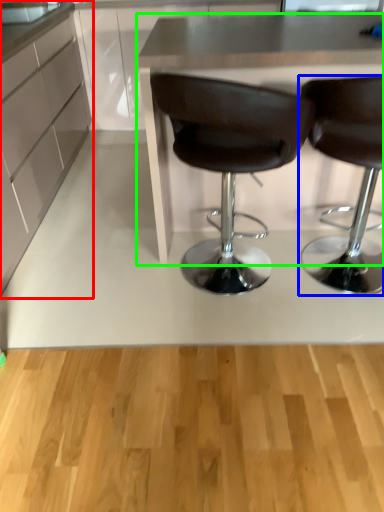
Question: Which object is positioned farthest from cabinetry (highlighted by a red box)? Select from chair (highlighted by a blue box) and table (highlighted by a green box).

Choices:
 (A) chair
 (B) table

Answer: (A)